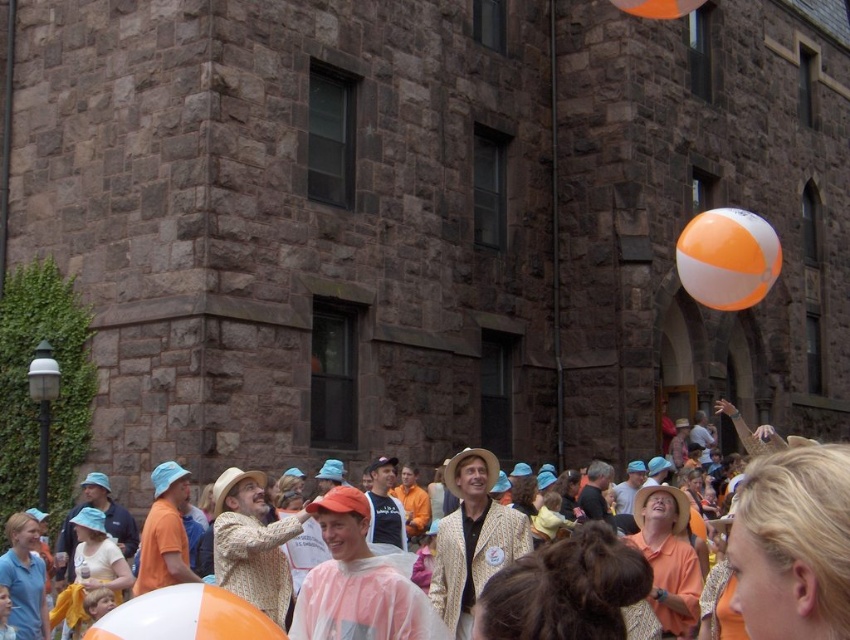
Question: Can you confirm if orange and white beach ball at upper right is thinner than orange and white striped balloon at lower left?

Choices:
 (A) no
 (B) yes

Answer: (A)

Question: Which object is positioned farthest from the orange/beach ball at upper right?

Choices:
 (A) orange and white striped balloon at lower left
 (B) orange and white beach ball at upper right

Answer: (A)

Question: Is orange and white beach ball at lower left wider than orange and white striped balloon at lower left?

Choices:
 (A) no
 (B) yes

Answer: (B)

Question: Among these objects, which one is nearest to the camera?

Choices:
 (A) orange/beach ball at upper right
 (B) orange and white striped balloon at lower left

Answer: (B)

Question: Can you confirm if orange and white beach ball at upper right is positioned below orange and white striped balloon at lower left?

Choices:
 (A) yes
 (B) no

Answer: (B)

Question: Estimate the real-world distances between objects in this image. Which object is closer to the orange and white striped balloon at lower left?

Choices:
 (A) orange and white beach ball at lower left
 (B) orange and white beach ball at upper right
 (C) orange/beach ball at upper right

Answer: (A)